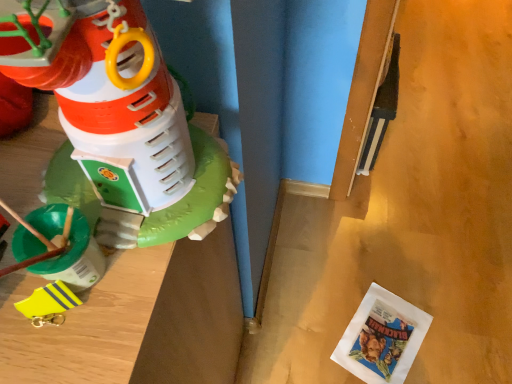
Identify the location of unoccupied space behind yellow rubber boot at left, marked as the 1th toy in a bottom-to-top arrangement. The height and width of the screenshot is (384, 512). (74, 195).